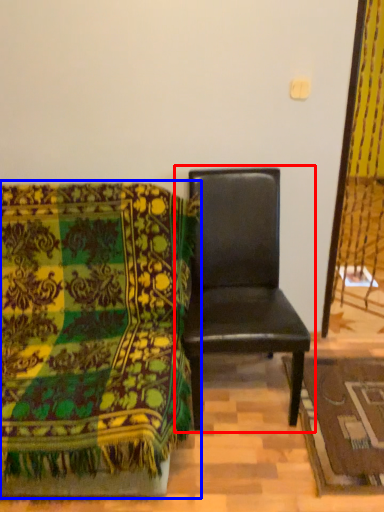
Question: Among these objects, which one is farthest to the camera, chair (highlighted by a red box) or chair (highlighted by a blue box)?

Choices:
 (A) chair
 (B) chair

Answer: (A)